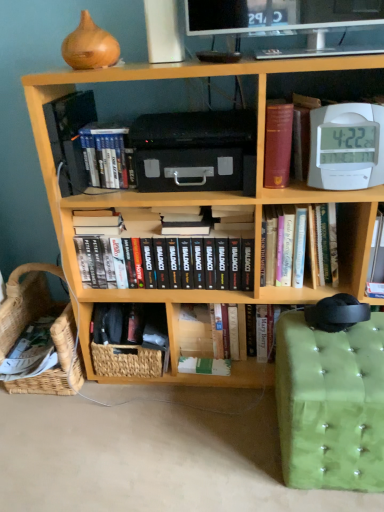
Find the location of a particular element. white plastic clock at upper right, acting as the first book starting from the right is located at coordinates (344, 145).

Describe the element at coordinates (195, 330) in the screenshot. I see `hardcover book at center, placed as the 2th paperback book when sorted from bottom to top` at that location.

Locate an element on the screen. Image resolution: width=384 pixels, height=512 pixels. woven basket at lower left, acting as the 1th basket starting from the right is located at coordinates (132, 344).

What do you see at coordinates (204, 366) in the screenshot?
I see `white paper at center, the second paperback book positioned from the back` at bounding box center [204, 366].

This screenshot has width=384, height=512. What do you see at coordinates (331, 404) in the screenshot?
I see `green tufted fabric swivel chair at lower right` at bounding box center [331, 404].

Image resolution: width=384 pixels, height=512 pixels. Identify the location of leather-bound book at upper right, positioned as the first paperback book in top-to-bottom order. click(278, 143).

Which is more to the right, hardcover book at center, the first paperback book in the back-to-front sequence, or wooden bookcase at center?

Positioned to the right is wooden bookcase at center.

From the image's perspective, which is above, hardcover book at center, placed as the third paperback book when sorted from front to back, or wooden bookcase at center?

wooden bookcase at center is shown above in the image.

How different are the orientations of hardcover book at center, placed as the third paperback book when sorted from front to back, and wooden bookcase at center in degrees?

hardcover book at center, placed as the third paperback book when sorted from front to back, and wooden bookcase at center are facing 0.246 degrees away from each other.

Does point (189, 352) appear closer or farther from the camera than point (135, 218)?

Clearly, point (189, 352) is more distant from the camera than point (135, 218).

Considering the sizes of leather-bound book at upper right, placed as the third paperback book when sorted from back to front, and hardcover book at center, placed as the third paperback book when sorted from front to back, in the image, is leather-bound book at upper right, placed as the third paperback book when sorted from back to front, taller or shorter than hardcover book at center, placed as the third paperback book when sorted from front to back,?

Clearly, leather-bound book at upper right, placed as the third paperback book when sorted from back to front, is taller compared to hardcover book at center, placed as the third paperback book when sorted from front to back.

Is leather-bound book at upper right, positioned as the first paperback book in top-to-bottom order, in contact with hardcover book at center, placed as the third paperback book when sorted from front to back?

leather-bound book at upper right, positioned as the first paperback book in top-to-bottom order, and hardcover book at center, placed as the third paperback book when sorted from front to back, are clearly separated.

Which of these two, leather-bound book at upper right, which is the 1th paperback book from front to back, or hardcover book at center, placed as the third paperback book when sorted from front to back, is wider?

hardcover book at center, placed as the third paperback book when sorted from front to back, is wider.

Does point (264, 158) come behind point (207, 355)?

No.

Is green tufted fabric swivel chair at lower right taller or shorter than white plastic clock at upper right, acting as the first book starting from the right?

Clearly, green tufted fabric swivel chair at lower right is taller compared to white plastic clock at upper right, acting as the first book starting from the right.

Which is less distant, (x=365, y=349) or (x=371, y=173)?

Point (x=365, y=349) is positioned closer to the camera compared to point (x=371, y=173).

Between green tufted fabric swivel chair at lower right and white plastic clock at upper right, acting as the first book starting from the right, which one is positioned in front?

Positioned in front is green tufted fabric swivel chair at lower right.

From the image's perspective, relative to hardcover books at center left, positioned as the 1th book in left-to-right order, is woven natural basket at lower left, the 2th basket in the right-to-left sequence, above or below?

woven natural basket at lower left, the 2th basket in the right-to-left sequence, is situated lower than hardcover books at center left, positioned as the 1th book in left-to-right order, in the image.

Is woven natural basket at lower left, the 2th basket in the right-to-left sequence, at the right side of hardcover books at center left, positioned as the 1th book in left-to-right order?

No.

Is woven natural basket at lower left, the 2th basket in the right-to-left sequence, smaller than hardcover books at center left, positioned as the 1th book in left-to-right order?

Incorrect, woven natural basket at lower left, the 2th basket in the right-to-left sequence, is not smaller in size than hardcover books at center left, positioned as the 1th book in left-to-right order.

Is woven natural basket at lower left, the 2th basket in the right-to-left sequence, placed right next to hardcover books at center left, positioned as the 1th book in left-to-right order?

No, woven natural basket at lower left, the 2th basket in the right-to-left sequence, is not making contact with hardcover books at center left, positioned as the 1th book in left-to-right order.

Relative to green tufted fabric swivel chair at lower right, is hardcover book at center, the third book viewed from the left, in front or behind?

hardcover book at center, the third book viewed from the left, is positioned farther from the viewer than green tufted fabric swivel chair at lower right.

Locate an element on the screen. This screenshot has width=384, height=512. book that is the 2nd object located behind the green tufted fabric swivel chair at lower right is located at coordinates (323, 244).

Is hardcover book at center, the second book viewed from the right, inside the boundaries of green tufted fabric swivel chair at lower right, or outside?

hardcover book at center, the second book viewed from the right, is not enclosed by green tufted fabric swivel chair at lower right.

What's the angular difference between woven natural basket at lower left, the 2th basket in the right-to-left sequence, and wooden bookcase at center's facing directions?

The facing directions of woven natural basket at lower left, the 2th basket in the right-to-left sequence, and wooden bookcase at center are 0.325 degrees apart.

Is woven natural basket at lower left, the 2th basket in the right-to-left sequence, oriented towards wooden bookcase at center?

No, woven natural basket at lower left, the 2th basket in the right-to-left sequence, is not oriented towards wooden bookcase at center.

Is woven natural basket at lower left, which ranks as the first basket in left-to-right order, shorter than wooden bookcase at center?

Correct, woven natural basket at lower left, which ranks as the first basket in left-to-right order, is not as tall as wooden bookcase at center.

From their relative heights in the image, would you say hardcover book at center, the second book viewed from the right, is taller or shorter than hardcover books at center, which ranks as the 3th book in right-to-left order?

Clearly, hardcover book at center, the second book viewed from the right, is taller compared to hardcover books at center, which ranks as the 3th book in right-to-left order.

How much distance is there between hardcover book at center, the third book viewed from the left, and hardcover books at center, which ranks as the 2th book in left-to-right order?

hardcover book at center, the third book viewed from the left, is 11.10 inches away from hardcover books at center, which ranks as the 2th book in left-to-right order.

Which is more to the right, hardcover book at center, the second book viewed from the right, or hardcover books at center, which ranks as the 3th book in right-to-left order?

hardcover book at center, the second book viewed from the right.

Considering the sizes of hardcover book at center, the third book viewed from the left, and hardcover books at center, which ranks as the 2th book in left-to-right order, in the image, is hardcover book at center, the third book viewed from the left, wider or thinner than hardcover books at center, which ranks as the 2th book in left-to-right order,?

Considering their sizes, hardcover book at center, the third book viewed from the left, looks broader than hardcover books at center, which ranks as the 2th book in left-to-right order.

Locate an element on the screen. The width and height of the screenshot is (384, 512). the 1st paperback book positioned below the wooden bookcase at center (from the image's perspective) is located at coordinates (195, 330).

From the leather-bound book at upper right, placed as the third paperback book when sorted from back to front, count 2nd paperback books backward and point to it. Please provide its 2D coordinates.

[(195, 330)]

Considering their positions, is woven natural basket at lower left, the 2th basket in the right-to-left sequence, positioned closer to woven basket at lower left, the second basket viewed from the left, than green tufted fabric swivel chair at lower right?

woven natural basket at lower left, the 2th basket in the right-to-left sequence, is closer to woven basket at lower left, the second basket viewed from the left.

Looking at the image, which one is located further to hardcover books at center, which ranks as the 2th book in left-to-right order, leather-bound book at upper right, which is the 1th paperback book from front to back, or white plastic clock at upper right, acting as the first book starting from the right?

The object further to hardcover books at center, which ranks as the 2th book in left-to-right order, is white plastic clock at upper right, acting as the first book starting from the right.

Looking at the image, which one is located further to leather-bound book at upper right, which ranks as the 3th paperback book in bottom-to-top order, hardcover books at center left, positioned as the 1th book in left-to-right order, or woven natural basket at lower left, which ranks as the first basket in left-to-right order?

The object further to leather-bound book at upper right, which ranks as the 3th paperback book in bottom-to-top order, is woven natural basket at lower left, which ranks as the first basket in left-to-right order.

Based on their spatial positions, is hardcover book at center, placed as the third paperback book when sorted from front to back, or woven basket at lower left, acting as the 1th basket starting from the right, further from green tufted fabric swivel chair at lower right?

Based on the image, woven basket at lower left, acting as the 1th basket starting from the right, appears to be further to green tufted fabric swivel chair at lower right.

When comparing their distances from woven basket at lower left, acting as the 1th basket starting from the right, does hardcover book at center, the first paperback book in the back-to-front sequence, or hardcover books at center, which ranks as the 3th book in right-to-left order, seem further?

Among the two, hardcover books at center, which ranks as the 3th book in right-to-left order, is located further to woven basket at lower left, acting as the 1th basket starting from the right.

From the image, which object appears to be farther from hardcover book at center, the third book viewed from the left, hardcover book at center, the first paperback book in the back-to-front sequence, or woven natural basket at lower left, the 2th basket in the right-to-left sequence?

woven natural basket at lower left, the 2th basket in the right-to-left sequence, is further to hardcover book at center, the third book viewed from the left.

From the image, which object appears to be nearer to hardcover book at center, the second book viewed from the right, wooden bookcase at center or white paper at center, the 2th paperback book viewed from the front?

The object closer to hardcover book at center, the second book viewed from the right, is wooden bookcase at center.

Which object lies nearer to the anchor point white paper at center, the second paperback book positioned from the back, leather-bound book at upper right, which is the 1th paperback book from front to back, or hardcover books at center left, positioned as the 1th book in left-to-right order?

hardcover books at center left, positioned as the 1th book in left-to-right order, lies closer to white paper at center, the second paperback book positioned from the back, than the other object.

At what (x,y) coordinates should I click in order to perform the action: click on bookcase between hardcover books at center left, the 4th book when ordered from right to left, and green tufted fabric swivel chair at lower right from top to bottom. Please return your answer as a coordinate pair (x, y). The image size is (384, 512). Looking at the image, I should click on click(x=199, y=204).

I want to click on book between woven basket at lower left, acting as the 1th basket starting from the right, and hardcover book at center, the third book viewed from the left, in the horizontal direction, so click(196, 255).

The height and width of the screenshot is (512, 384). In order to click on bookcase between leather-bound book at upper right, placed as the third paperback book when sorted from back to front, and woven basket at lower left, acting as the 1th basket starting from the right, from top to bottom in this screenshot , I will do `click(199, 204)`.

Locate an element on the screen. The image size is (384, 512). bookcase between hardcover books at center left, the 4th book when ordered from right to left, and hardcover book at center, the third book viewed from the left is located at coordinates (199, 204).